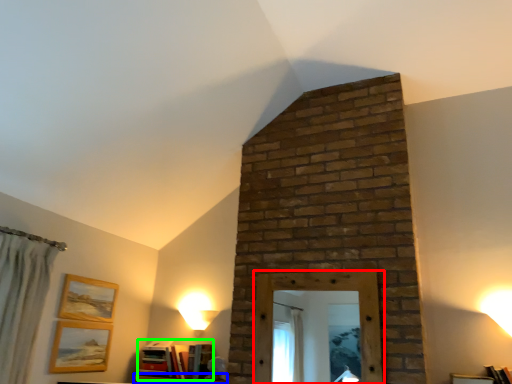
Question: Which object is positioned farthest from window frame (highlighted by a red box)? Select from furniture (highlighted by a blue box) and book (highlighted by a green box).

Choices:
 (A) furniture
 (B) book

Answer: (A)